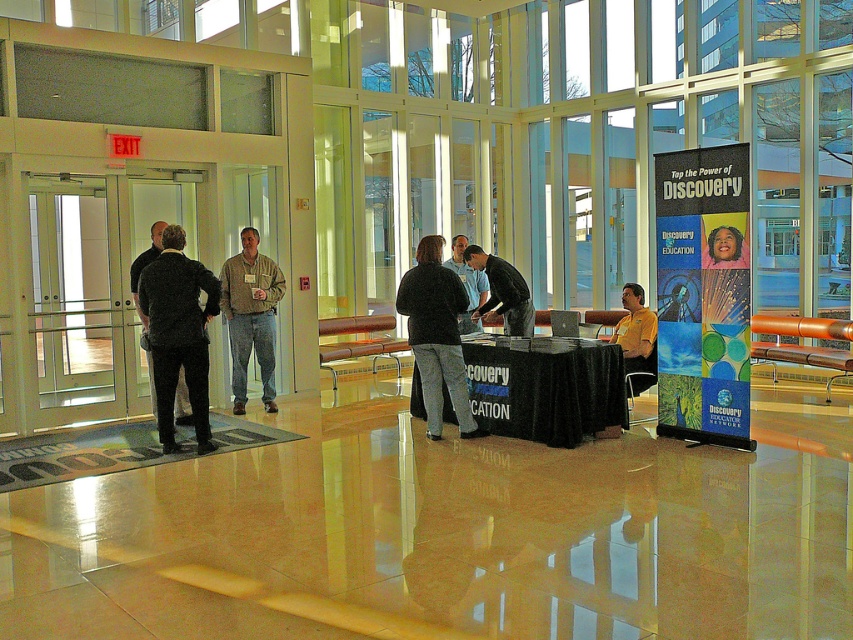
Is khaki cotton shirt at center positioned at the back of black shirt at center?

Yes, it is.

The width and height of the screenshot is (853, 640). What do you see at coordinates (251, 316) in the screenshot? I see `khaki cotton shirt at center` at bounding box center [251, 316].

At what (x,y) coordinates should I click in order to perform the action: click on khaki cotton shirt at center. Please return your answer as a coordinate pair (x, y). The width and height of the screenshot is (853, 640). Looking at the image, I should click on (251, 316).

Is point (180, 419) positioned after point (480, 324)?

No, (180, 419) is in front of (480, 324).

What do you see at coordinates (138, 298) in the screenshot? I see `dark gray suit at left` at bounding box center [138, 298].

This screenshot has width=853, height=640. Describe the element at coordinates (138, 298) in the screenshot. I see `dark gray suit at left` at that location.

You are a GUI agent. You are given a task and a screenshot of the screen. Output one action in this format:
    pyautogui.click(x=<x>, y=<y>)
    Task: Click on the dark gray suit at left
    
    Given the screenshot: What is the action you would take?
    pyautogui.click(x=138, y=298)

Does black shirt at center appear under dark blue sweater at center?

Correct, black shirt at center is located below dark blue sweater at center.

Is point (479, 312) positioned after point (457, 314)?

No, it is not.

Who is more distant from viewer, (521, 282) or (479, 305)?

The point (479, 305) is more distant.

I want to click on black shirt at center, so click(503, 292).